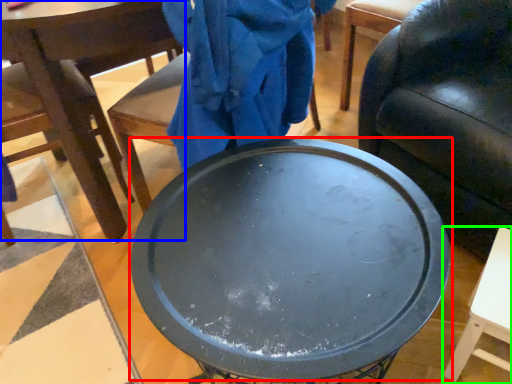
Question: Which is farther away from round table (highlighted by a red box)? chair (highlighted by a blue box) or table (highlighted by a green box)?

Choices:
 (A) chair
 (B) table

Answer: (A)